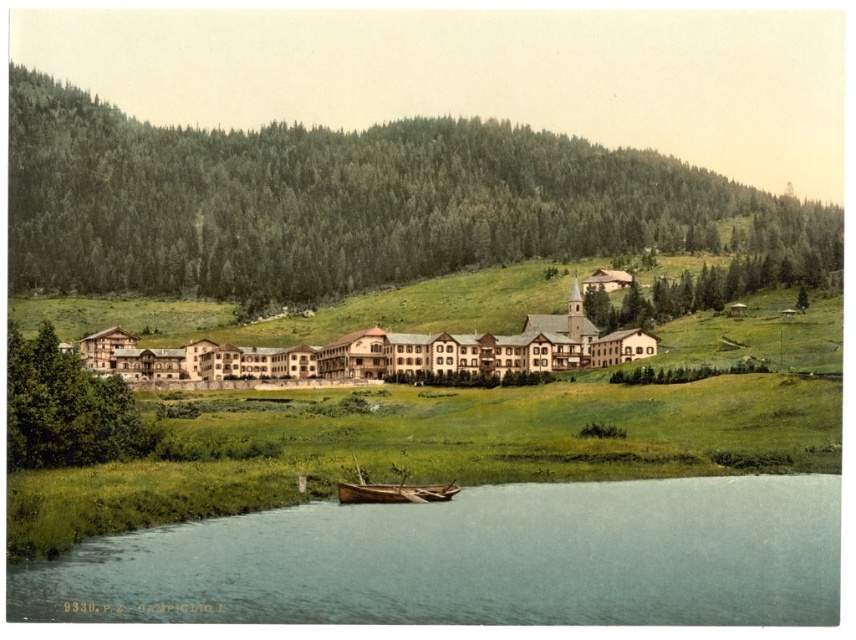
Is point (619, 332) in front of point (360, 502)?

That is False.

Is beige stone hotel at center bigger than wooden boat at lower center?

Correct, beige stone hotel at center is larger in size than wooden boat at lower center.

Does point (444, 362) come in front of point (388, 493)?

No, it is behind (388, 493).

I want to click on beige stone hotel at center, so click(x=355, y=353).

Between beige stone hotel at center and green textured tree at upper right, which one has less height?

beige stone hotel at center

Identify the location of beige stone hotel at center. (355, 353).

Identify the location of beige stone hotel at center. (355, 353).

The image size is (856, 640). In order to click on blue water at lower center in this screenshot , I will do point(474,560).

Does blue water at lower center have a greater height compared to green leafy tree at left?

No, blue water at lower center is not taller than green leafy tree at left.

The image size is (856, 640). Describe the element at coordinates (474, 560) in the screenshot. I see `blue water at lower center` at that location.

The image size is (856, 640). What are the coordinates of `blue water at lower center` in the screenshot? It's located at (474, 560).